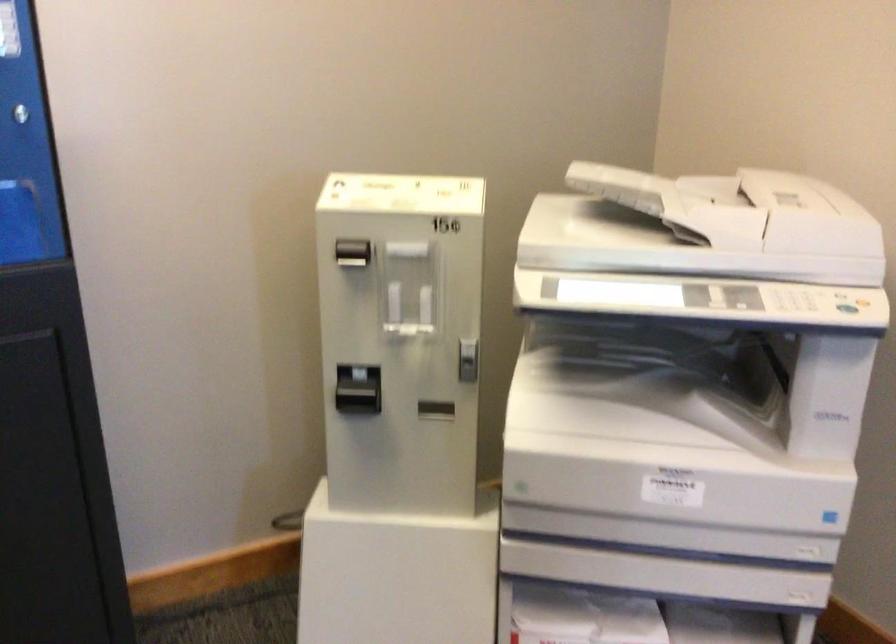
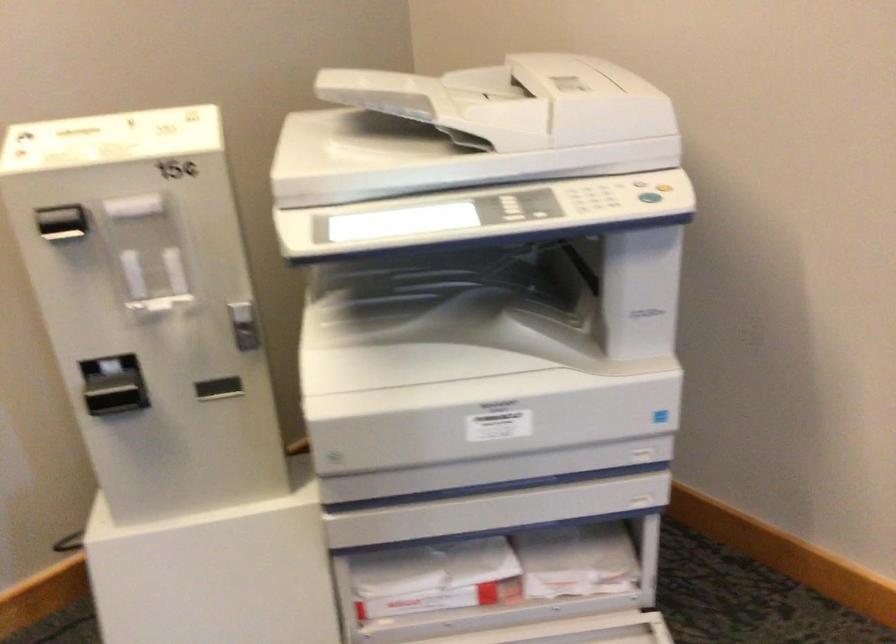
Question: The images are taken continuously from a first-person perspective. In which direction is your viewpoint rotating?

Choices:
 (A) Left
 (B) Right
 (C) Up
 (D) Down

Answer: (B)